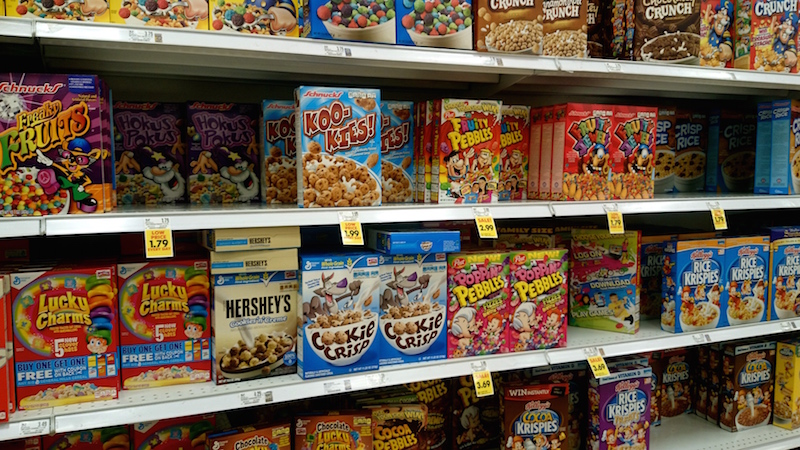
Image resolution: width=800 pixels, height=450 pixels. Identify the location of shelf tags. (158, 247), (350, 234), (490, 225), (618, 220), (728, 217), (492, 378), (598, 367).